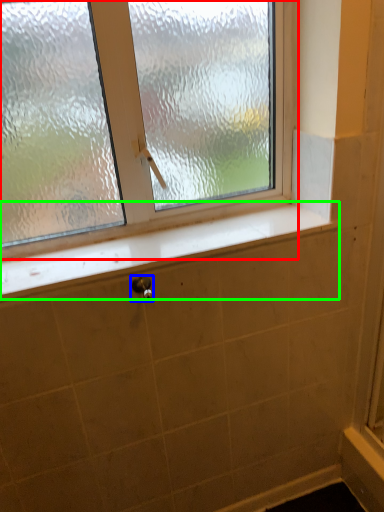
Question: Which is nearer to the window (highlighted by a red box)? shower (highlighted by a blue box) or window sill (highlighted by a green box).

Choices:
 (A) shower
 (B) window sill

Answer: (B)